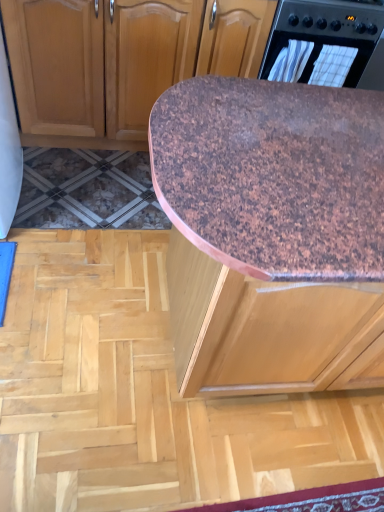
What do you see at coordinates (274, 176) in the screenshot? This screenshot has height=512, width=384. I see `brown speckled granite countertop at center` at bounding box center [274, 176].

This screenshot has height=512, width=384. In order to click on brown speckled plywood at center in this screenshot , I will do `click(144, 395)`.

From the picture: In order to face black plastic oven at upper right, should I rotate leftwards or rightwards?

Rotate right and turn 16.581 degrees.

Locate an element on the screen. This screenshot has height=512, width=384. brown speckled granite countertop at center is located at coordinates (274, 176).

Considering the points (335, 188) and (111, 461), which point is in front, point (335, 188) or point (111, 461)?

The point (335, 188) is closer.

Is brown speckled granite countertop at center closer to the viewer compared to brown speckled plywood at center?

Yes, brown speckled granite countertop at center is closer to the viewer.

Is brown speckled granite countertop at center at the left side of brown speckled plywood at center?

In fact, brown speckled granite countertop at center is to the right of brown speckled plywood at center.

How distant is brown speckled granite countertop at center from brown speckled plywood at center?

brown speckled granite countertop at center is 87.47 centimeters away from brown speckled plywood at center.

Considering the positions of point (95, 263) and point (275, 24), is point (95, 263) closer or farther from the camera than point (275, 24)?

Point (95, 263) is positioned closer to the camera compared to point (275, 24).

Is brown speckled plywood at center not near black plastic oven at upper right?

brown speckled plywood at center is far away from black plastic oven at upper right.

Is brown speckled plywood at center closer to the viewer compared to black plastic oven at upper right?

That is True.

Is brown speckled plywood at center wider or thinner than black plastic oven at upper right?

brown speckled plywood at center is wider than black plastic oven at upper right.

Where is `plywood below the black plastic oven at upper right (from the image's perspective)`? plywood below the black plastic oven at upper right (from the image's perspective) is located at coordinates (144, 395).

Is black plastic oven at upper right outside of brown speckled plywood at center?

That's correct, black plastic oven at upper right is outside of brown speckled plywood at center.

Looking at this image, which of these two, black plastic oven at upper right or brown speckled plywood at center, is wider?

brown speckled plywood at center is wider.

Are brown speckled granite countertop at center and black plastic oven at upper right beside each other?

There is a gap between brown speckled granite countertop at center and black plastic oven at upper right.

Consider the image. From a real-world perspective, is brown speckled granite countertop at center positioned over black plastic oven at upper right based on gravity?

Incorrect, from a real-world perspective, brown speckled granite countertop at center is lower than black plastic oven at upper right.

Which is less distant, [348,226] or [359,85]?

Positioned in front is point [348,226].

Is brown speckled granite countertop at center inside the boundaries of black plastic oven at upper right, or outside?

brown speckled granite countertop at center is located beyond the bounds of black plastic oven at upper right.

Does black plastic oven at upper right have a greater height compared to brown speckled granite countertop at center?

In fact, black plastic oven at upper right may be shorter than brown speckled granite countertop at center.

This screenshot has height=512, width=384. What are the coordinates of `countertop below the black plastic oven at upper right (from the image's perspective)` in the screenshot? It's located at (274, 176).

Is black plastic oven at upper right not near brown speckled granite countertop at center?

No, there isn't a large distance between black plastic oven at upper right and brown speckled granite countertop at center.

From the picture: Which object is positioned more to the left, black plastic oven at upper right or brown speckled granite countertop at center?

Positioned to the left is brown speckled granite countertop at center.

Considering the relative positions of brown speckled plywood at center and brown speckled granite countertop at center in the image provided, is brown speckled plywood at center to the right of brown speckled granite countertop at center from the viewer's perspective?

Incorrect, brown speckled plywood at center is not on the right side of brown speckled granite countertop at center.

From a real-world perspective, is brown speckled plywood at center below brown speckled granite countertop at center?

Yes.

How far apart are brown speckled plywood at center and brown speckled granite countertop at center?

They are 34.44 inches apart.

Locate an element on the screen. The image size is (384, 512). plywood lying on the left of brown speckled granite countertop at center is located at coordinates (144, 395).

Where is `home appliance lying on the right of brown speckled plywood at center`? home appliance lying on the right of brown speckled plywood at center is located at coordinates (323, 41).

When comparing their distances from brown speckled granite countertop at center, does black plastic oven at upper right or brown speckled plywood at center seem closer?

brown speckled plywood at center.

From the image, which object appears to be farther from brown speckled plywood at center, black plastic oven at upper right or brown speckled granite countertop at center?

black plastic oven at upper right is positioned further to the anchor brown speckled plywood at center.

Which object lies nearer to the anchor point brown speckled plywood at center, brown speckled granite countertop at center or black plastic oven at upper right?

brown speckled granite countertop at center lies closer to brown speckled plywood at center than the other object.

When comparing their distances from black plastic oven at upper right, does brown speckled plywood at center or brown speckled granite countertop at center seem closer?

The object closer to black plastic oven at upper right is brown speckled granite countertop at center.

Considering their positions, is brown speckled plywood at center positioned closer to brown speckled granite countertop at center than black plastic oven at upper right?

brown speckled plywood at center.

Based on their spatial positions, is brown speckled granite countertop at center or brown speckled plywood at center closer to black plastic oven at upper right?

Based on the image, brown speckled granite countertop at center appears to be nearer to black plastic oven at upper right.

Find the location of a particular element. The image size is (384, 512). plywood between black plastic oven at upper right and brown speckled granite countertop at center vertically is located at coordinates (144, 395).